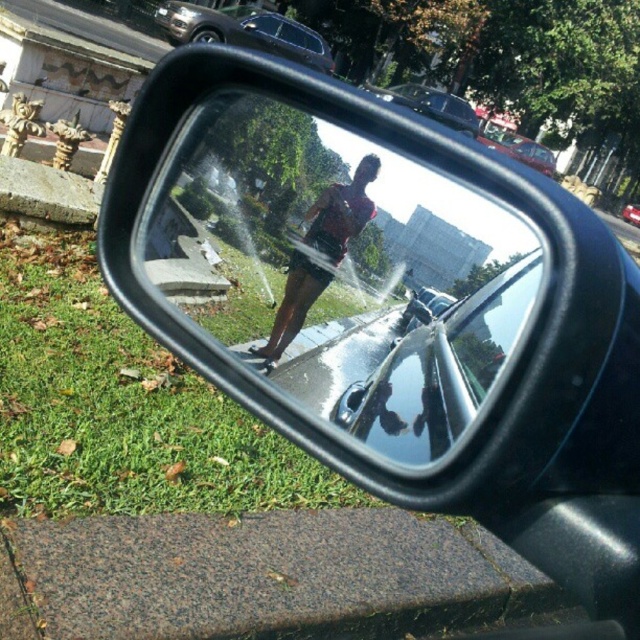
Question: Among these points, which one is nearest to the camera?

Choices:
 (A) (172, 4)
 (B) (269, 113)
 (C) (547, 154)

Answer: (B)

Question: Which object appears farthest from the camera in this image?

Choices:
 (A) black glossy mirror at center
 (B) metallic silver car at upper center
 (C) transparent glass car window at center

Answer: (B)

Question: Is metallic silver car at upper center positioned at the back of shiny metallic car at center?

Choices:
 (A) yes
 (B) no

Answer: (A)

Question: Does black glossy mirror at center appear on the right side of metallic silver car at upper center?

Choices:
 (A) yes
 (B) no

Answer: (A)

Question: Can you confirm if matte black shorts at center is positioned to the right of metallic silver car at center?

Choices:
 (A) yes
 (B) no

Answer: (B)

Question: Estimate the real-world distances between objects in this image. Which object is closer to the shiny metallic car at center?

Choices:
 (A) metallic silver car at upper center
 (B) matte black shorts at center
 (C) transparent glass car window at center
 (D) black glossy mirror at center

Answer: (D)